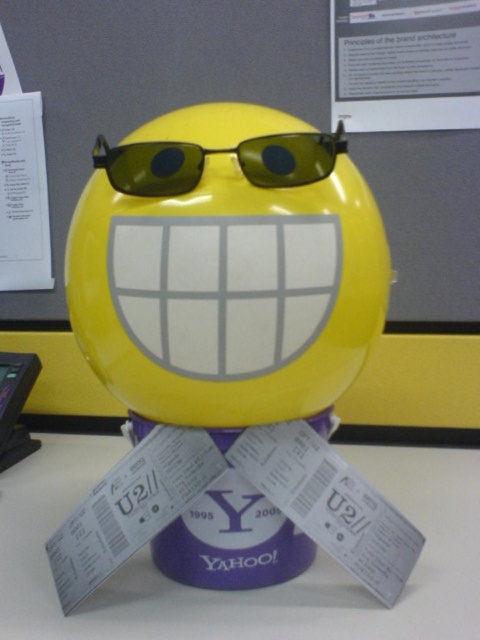
Question: Which point is farther to the camera?

Choices:
 (A) (314, 420)
 (B) (210, 435)
 (C) (311, 170)
 (D) (19, 387)

Answer: (D)

Question: Does purple matte/yellow plastic at center lie in front of black plastic phone at lower left?

Choices:
 (A) yes
 (B) no

Answer: (A)

Question: Considering the relative positions of purple paper tape at lower center and green plastic sunglasses at center in the image provided, where is purple paper tape at lower center located with respect to green plastic sunglasses at center?

Choices:
 (A) right
 (B) left

Answer: (B)

Question: Can you confirm if purple matte/yellow plastic at center is positioned above black plastic phone at lower left?

Choices:
 (A) yes
 (B) no

Answer: (B)

Question: Which object appears farthest from the camera in this image?

Choices:
 (A) black plastic phone at lower left
 (B) purple matte/yellow plastic at center
 (C) purple paper tape at lower center

Answer: (A)

Question: Which point is closer to the camera?

Choices:
 (A) (183, 147)
 (B) (222, 484)
 (C) (55, 616)

Answer: (A)